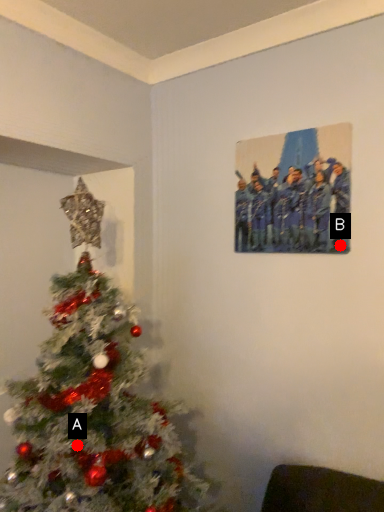
Question: Two points are circled on the image, labeled by A and B beside each circle. Which of the following is the closest to the observer?

Choices:
 (A) A is closer
 (B) B is closer

Answer: (A)